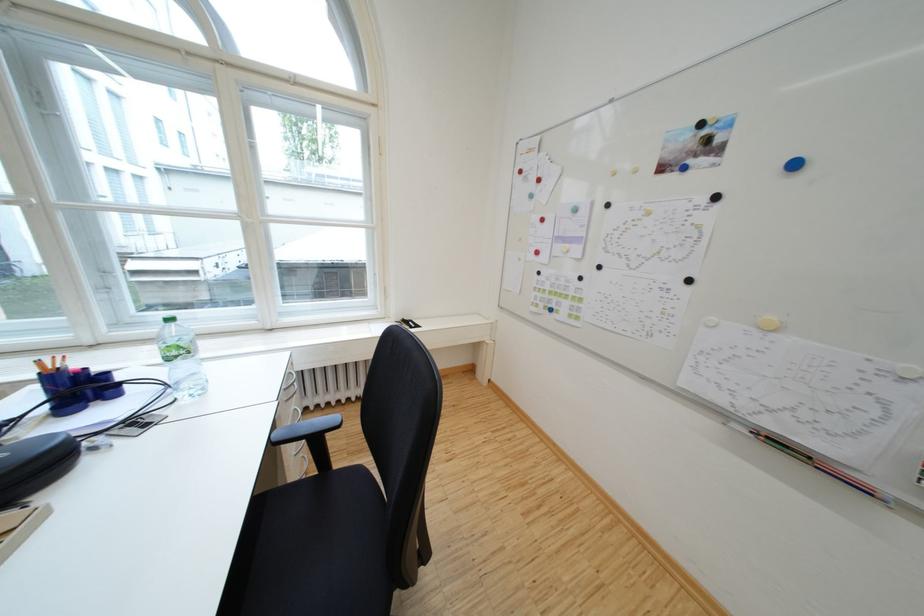
Find where to resting arm the black chair armrest. Please return your answer as a coordinate pair (x, y).

(306, 429)